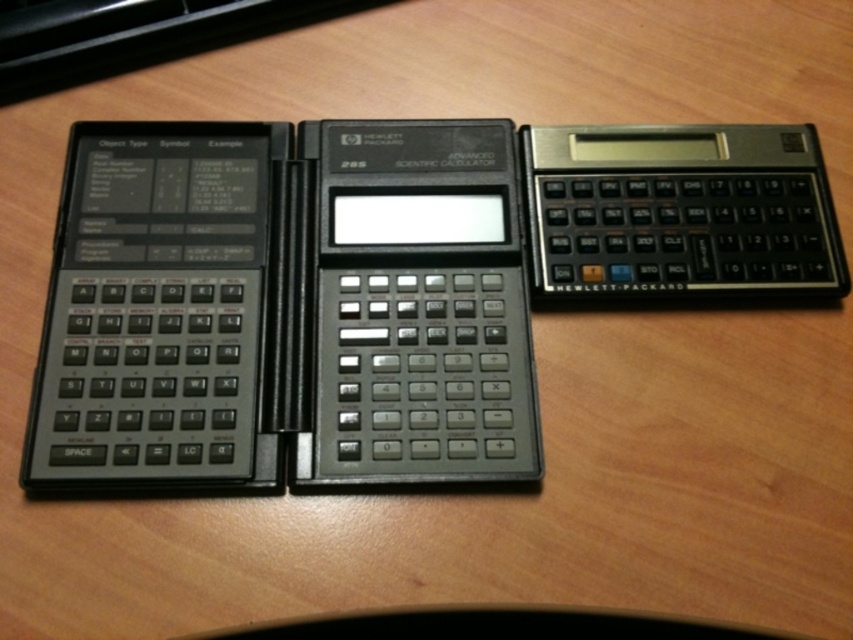
You have two calculators on a desk. The black matte scientific calculator at left and the black plastic calculator at upper right. Which one has a greater width?

The black matte scientific calculator at left has a greater width than the black plastic calculator at upper right.

You are organizing a desk and need to know the size relationship between the black matte scientific calculator at left and the black plastic keyboard at left. Which one is larger?

The black matte scientific calculator at left is bigger than the black plastic keyboard at left.

You are looking at the three HP calculators arranged on the desk. There are two points marked on the calculator on the left. One is at point coordinates [482,132] and the other at [212,13]. Which of these two points is closer to you?

Point [482,132] is closer to the viewer than point [212,13].